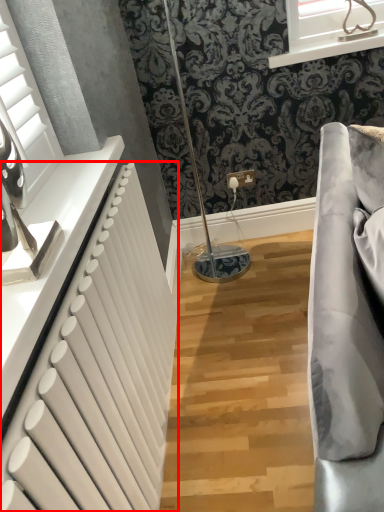
Question: In this image, where is radiator (annotated by the red box) located relative to window?

Choices:
 (A) left
 (B) right

Answer: (A)